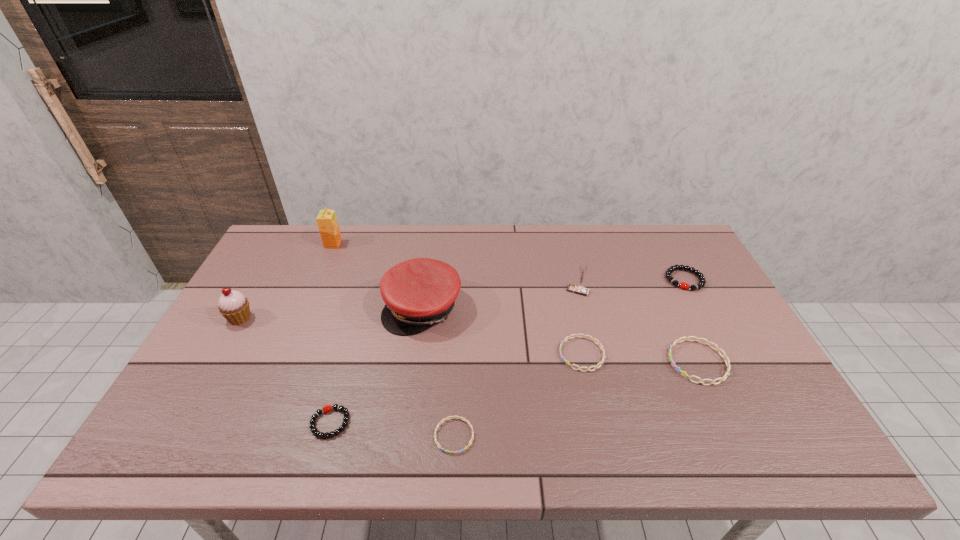
In order to click on free space located on the surface of the rightmost blue bracelet showing star-shaped elements in this screenshot , I will do `click(534, 362)`.

You are a GUI agent. You are given a task and a screenshot of the screen. Output one action in this format:
    pyautogui.click(x=<x>, y=<y>)
    Task: Click on the vacant area situated 0.070m on the back of the farther black bracelet
    
    Given the screenshot: What is the action you would take?
    pyautogui.click(x=671, y=254)

Locate an element on the screen. The image size is (960, 540). free space located on the surface of the second biggest blue bracelet showing star-shaped elements is located at coordinates (457, 354).

Where is `free space located on the surface of the second biggest blue bracelet showing star-shaped elements`? This screenshot has height=540, width=960. free space located on the surface of the second biggest blue bracelet showing star-shaped elements is located at coordinates (510, 354).

Where is `free space located 0.390m on the surface of the second biggest blue bracelet showing star-shaped elements`? free space located 0.390m on the surface of the second biggest blue bracelet showing star-shaped elements is located at coordinates (412, 354).

This screenshot has width=960, height=540. What are the coordinates of `blank space located on the right of the smaller black bracelet` in the screenshot? It's located at (485, 423).

Locate an element on the screen. Image resolution: width=960 pixels, height=540 pixels. orange juice located in the far edge section of the desktop is located at coordinates (327, 223).

Image resolution: width=960 pixels, height=540 pixels. Find the location of `bracelet situated at the far edge`. bracelet situated at the far edge is located at coordinates (670, 270).

Image resolution: width=960 pixels, height=540 pixels. Identify the location of object located in the left edge section of the desktop. coord(233,305).

This screenshot has width=960, height=540. In order to click on object that is at the far right corner in this screenshot , I will do coord(670,270).